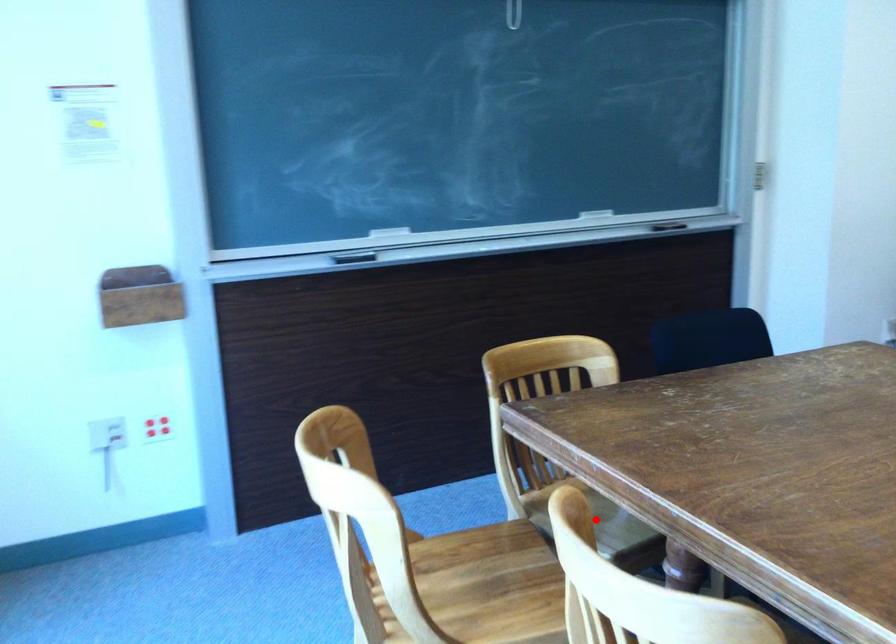
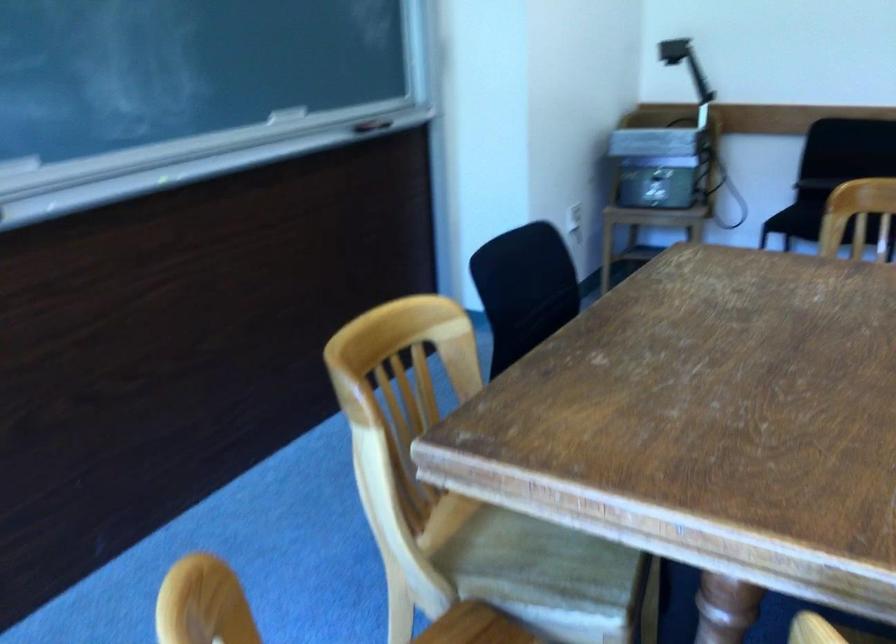
Question: I am providing you with two images of the same scene from different viewpoints. A red point is shown in image1. For the corresponding object point in image2, is it positioned nearer or farther from the camera?

Choices:
 (A) Nearer
 (B) Farther

Answer: (A)